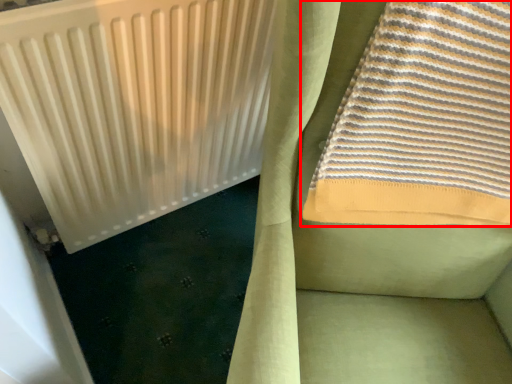
Question: Observing the image, what is the correct spatial positioning of towel (annotated by the red box) in reference to radiator?

Choices:
 (A) right
 (B) left

Answer: (A)